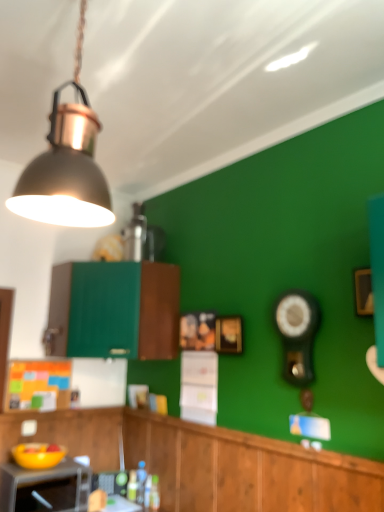
Find the location of `empty space that is ontop of wooden cabinet at lower center, which is the 1th cabinetry from bottom to top (from a real-world perspective)`. empty space that is ontop of wooden cabinet at lower center, which is the 1th cabinetry from bottom to top (from a real-world perspective) is located at coordinates (247, 428).